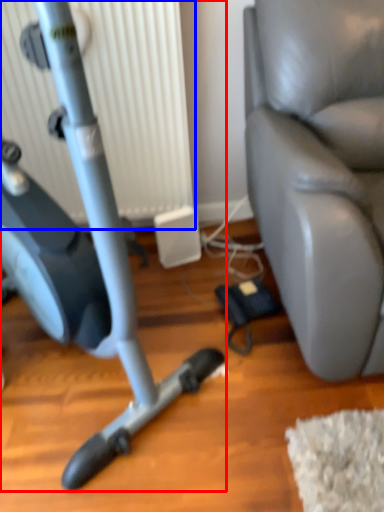
Question: Which point is closer to the camera, stationary bicycle (highlighted by a red box) or radiator (highlighted by a blue box)?

Choices:
 (A) stationary bicycle
 (B) radiator

Answer: (A)